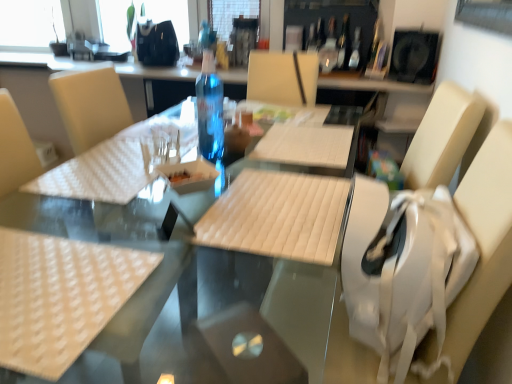
Question: In terms of width, does transparent plastic bottle at center, the first bottle in the left-to-right sequence, look wider or thinner when compared to transparent glass window at upper left?

Choices:
 (A) wide
 (B) thin

Answer: (B)

Question: Visually, is transparent plastic bottle at center, which is the third bottle from top to bottom, positioned to the left or to the right of transparent glass window at upper left?

Choices:
 (A) right
 (B) left

Answer: (A)

Question: Estimate the real-world distances between objects in this image. Which object is farther from the transparent plastic bottle at center, the second bottle positioned from the right?

Choices:
 (A) transparent plastic bottle at upper center, the 2th bottle from the bottom
 (B) transparent glass window at upper left
 (C) white quilted placemat at center
 (D) white quilted fabric at center
 (E) white fabric swivel chair at right

Answer: (B)

Question: Which object is the farthest from the translucent glass wine bottle at upper center?

Choices:
 (A) beige quilted placemat at lower left
 (B) white quilted placemat at center
 (C) transparent glass window at upper left
 (D) white quilted fabric at center
 (E) transparent plastic bottle at center, positioned as the first bottle in bottom-to-top order

Answer: (C)